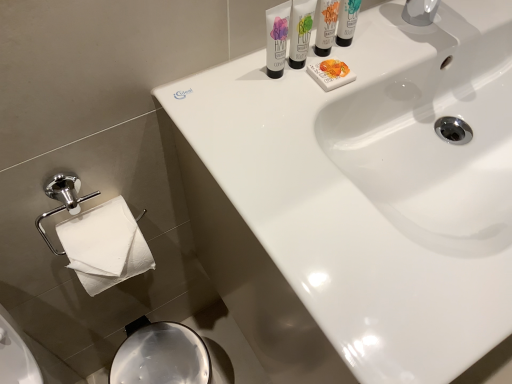
At what (x,y) coordinates should I click in order to perform the action: click on unoccupied region to the right of matte white shaving cream at upper right, the 3th shaving cream from the left. Please return your answer as a coordinate pair (x, y). This screenshot has height=384, width=512. Looking at the image, I should click on (412, 39).